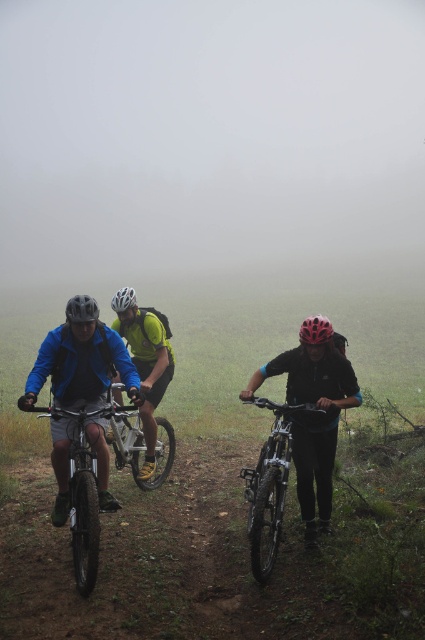
Which is behind, point (283, 362) or point (278, 502)?

The point (283, 362) is behind.

Based on the photo, between black matte helmet at center and shiny silver bicycle at center, which one appears on the right side from the viewer's perspective?

black matte helmet at center is more to the right.

Who is more forward, (320, 497) or (268, 572)?

Positioned in front is point (268, 572).

I want to click on black matte helmet at center, so click(x=312, y=419).

Is point (85, 317) positioned behind point (112, 300)?

No, (85, 317) is closer to viewer.

Consider the image. Which of these two, matte black helmet at left or matte yellow helmet at center, stands taller?

matte yellow helmet at center is taller.

Does point (67, 321) come farther from viewer compared to point (129, 288)?

No, it is in front of (129, 288).

Find the location of a particular element. The width and height of the screenshot is (425, 640). matte black helmet at left is located at coordinates (82, 308).

Is point (291, 360) positioned in front of point (73, 532)?

No.

Is black matte helmet at center taller than shiny metallic bicycle at left?

Yes, black matte helmet at center is taller than shiny metallic bicycle at left.

Which is behind, point (331, 436) or point (79, 545)?

The point (331, 436) is more distant.

In order to click on black matte helmet at center in this screenshot , I will do `click(312, 419)`.